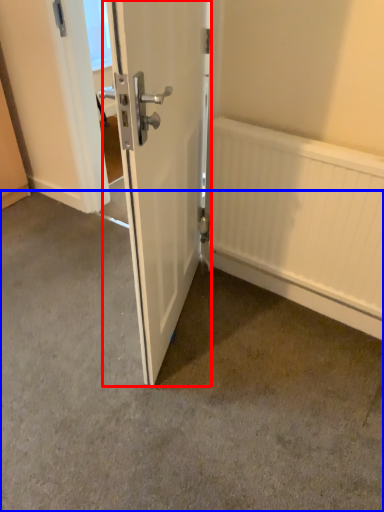
Question: Which of the following is the farthest to the observer, door (highlighted by a red box) or concrete (highlighted by a blue box)?

Choices:
 (A) door
 (B) concrete

Answer: (B)